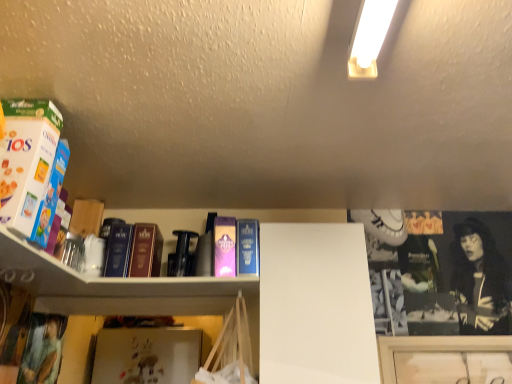
Question: Is blue cardboard cereal box at left, positioned as the 1th book in front-to-back order, taller or shorter than matte purple book at left, the 3th book when ordered from back to front?

Choices:
 (A) tall
 (B) short

Answer: (A)

Question: Looking at the image, does blue cardboard cereal box at left, positioned as the 1th book in front-to-back order, seem bigger or smaller compared to matte purple book at left, which is the 2th book in front-to-back order?

Choices:
 (A) small
 (B) big

Answer: (B)

Question: Estimate the real-world distances between objects in this image. Which object is closer to the hardcover book at center, which is counted as the 1th book, starting from the back?

Choices:
 (A) matte purple book at left, the 3th book when ordered from back to front
 (B) hardcover book at center, the second paperback book when ordered from left to right
 (C) purple matte paperback book at center, positioned as the second paperback book in right-to-left order
 (D) blue cardboard cereal box at left, which appears as the fourth book when viewed from the back
 (E) satin burgundy book at center, the 3th book positioned from the front

Answer: (E)

Question: Based on their relative distances, which object is farther from the purple matte paperback book at center, the first paperback book positioned from the left?

Choices:
 (A) blue cardboard cereal box at left, positioned as the 1th book in front-to-back order
 (B) hardcover book at center, which is the first paperback book in right-to-left order
 (C) hardcover book at center, which is counted as the 1th book, starting from the back
 (D) matte purple book at left, which is the 2th book in front-to-back order
 (E) satin burgundy book at center, acting as the 2th book starting from the back

Answer: (A)